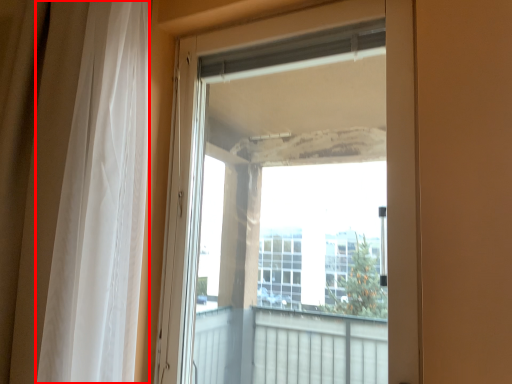
Question: Where is curtain (annotated by the red box) located in relation to door in the image?

Choices:
 (A) left
 (B) right

Answer: (A)